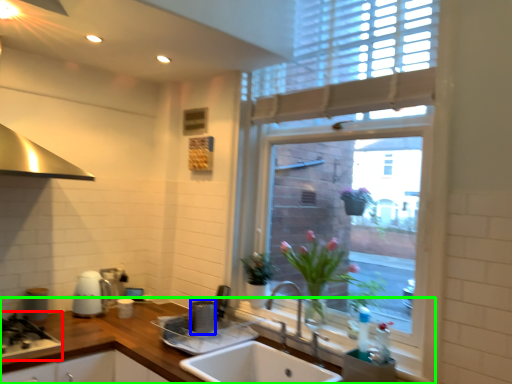
Question: Which object is the farthest from gas stove (highlighted by a red box)? Choose among these: appliance (highlighted by a blue box) or countertop (highlighted by a green box).

Choices:
 (A) appliance
 (B) countertop

Answer: (A)